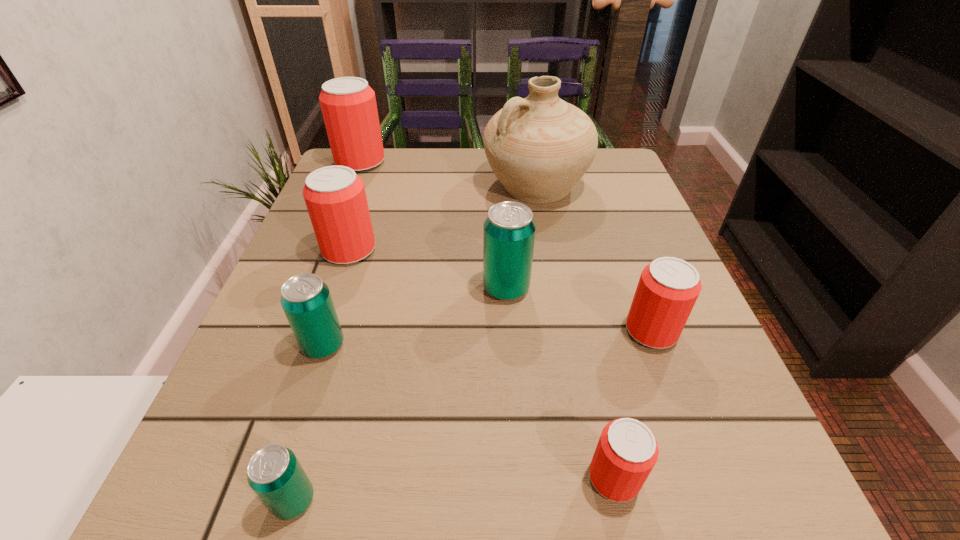
The height and width of the screenshot is (540, 960). What are the coordinates of `the tallest object` in the screenshot? It's located at (539, 147).

You are a GUI agent. You are given a task and a screenshot of the screen. Output one action in this format:
    pyautogui.click(x=<x>, y=<y>)
    Task: Click on the seventh shortest object
    
    Given the screenshot: What is the action you would take?
    pyautogui.click(x=348, y=104)

I want to click on the farthest red beer can, so click(348, 104).

The width and height of the screenshot is (960, 540). Identify the location of the sixth nearest object. (335, 197).

Where is `the second biggest red beer can`? the second biggest red beer can is located at coordinates (335, 197).

Find the location of `the rightmost teal beer can`. the rightmost teal beer can is located at coordinates (509, 230).

This screenshot has width=960, height=540. What are the coordinates of `the biggest teal beer can` in the screenshot? It's located at (509, 230).

The image size is (960, 540). Find the location of `the rightmost beer can`. the rightmost beer can is located at coordinates (668, 288).

Locate an element on the screen. the rightmost red beer can is located at coordinates (668, 288).

What are the coordinates of `the second smallest teal beer can` in the screenshot? It's located at (307, 303).